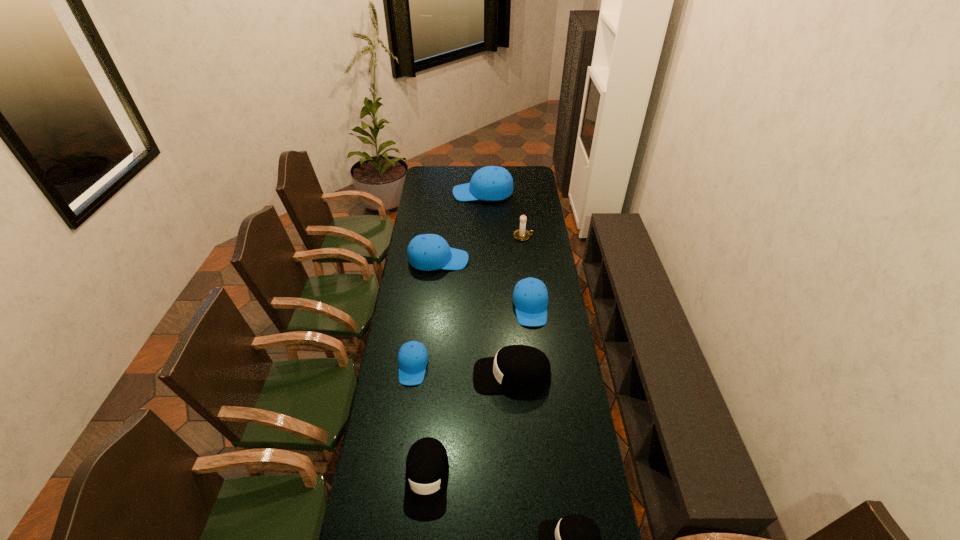
Where is `free space between the biggest black cap and the smallest blue cap`? The image size is (960, 540). free space between the biggest black cap and the smallest blue cap is located at coordinates (463, 371).

Locate an element on the screen. object that ranks as the third closest to the smallest black cap is located at coordinates pyautogui.click(x=413, y=358).

Select which object appears as the second closest to the smallest black cap. Please provide its 2D coordinates. Your answer should be formatted as a tuple, i.e. [(x, y)], where the tuple contains the x and y coordinates of a point satisfying the conditions above.

[(516, 368)]

Identify the location of the second closest cap to the white candle holder. (491, 183).

Where is `cap object that ranks as the second closest to the second farthest blue cap`? The image size is (960, 540). cap object that ranks as the second closest to the second farthest blue cap is located at coordinates (491, 183).

Point out which blue cap is positioned as the second nearest to the white candle holder. Please provide its 2D coordinates. Your answer should be formatted as a tuple, i.e. [(x, y)], where the tuple contains the x and y coordinates of a point satisfying the conditions above.

[(491, 183)]

Locate an element on the screen. The width and height of the screenshot is (960, 540). blue cap that is the fourth closest to the white candle holder is located at coordinates (413, 358).

Find the location of a particular element. This screenshot has height=540, width=960. black cap identified as the closest to the leftmost black cap is located at coordinates (516, 368).

The width and height of the screenshot is (960, 540). I want to click on the closest black cap relative to the second smallest black cap, so click(516, 368).

Identify the location of free point that satisfies the following two spatial constraints: 1. on the front-facing side of the farthest object; 2. on the front-facing side of the leftmost black cap. pyautogui.click(x=486, y=479).